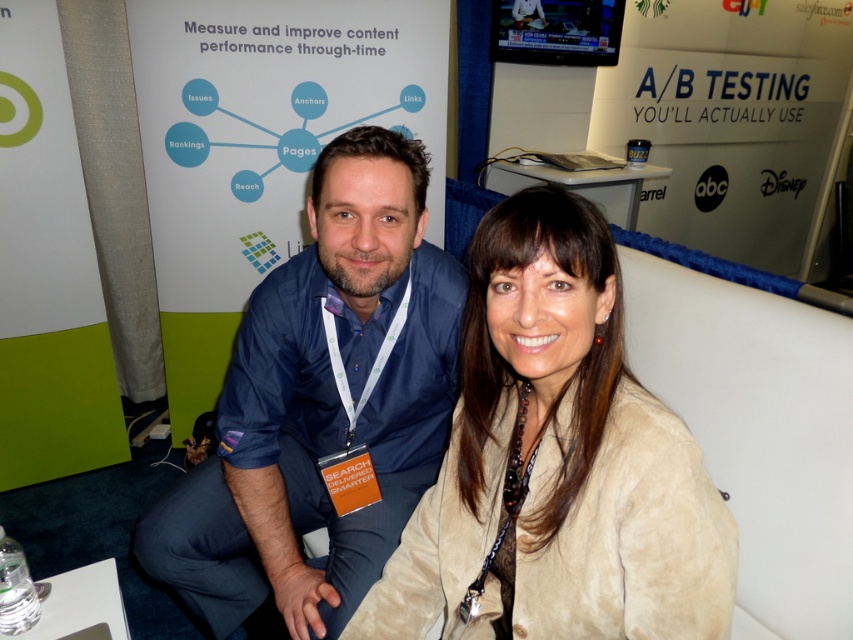
You are a photographer at a trade show who needs to capture a clear photo of both the beige suede jacket at center and the blue cotton shirt at center. The camera you are using has a focus range of 12 inches. Can you focus on both items simultaneously?

The beige suede jacket at center and blue cotton shirt at center are 13.57 inches apart from each other. Since the camera has a focus range of 12 inches, it cannot focus on both items at the same time because the distance between them exceeds the focus range.

Consider the image. You are a photographer at the event and want to focus on the beige suede jacket at center and the blue cotton shirt at center. Which one should you adjust your camera focus to first to ensure both are in focus?

The beige suede jacket at center is closer to the viewer than the blue cotton shirt at center, so you should focus on the beige suede jacket at center first. This will ensure the blue cotton shirt at center remains in focus as well since it is further away.